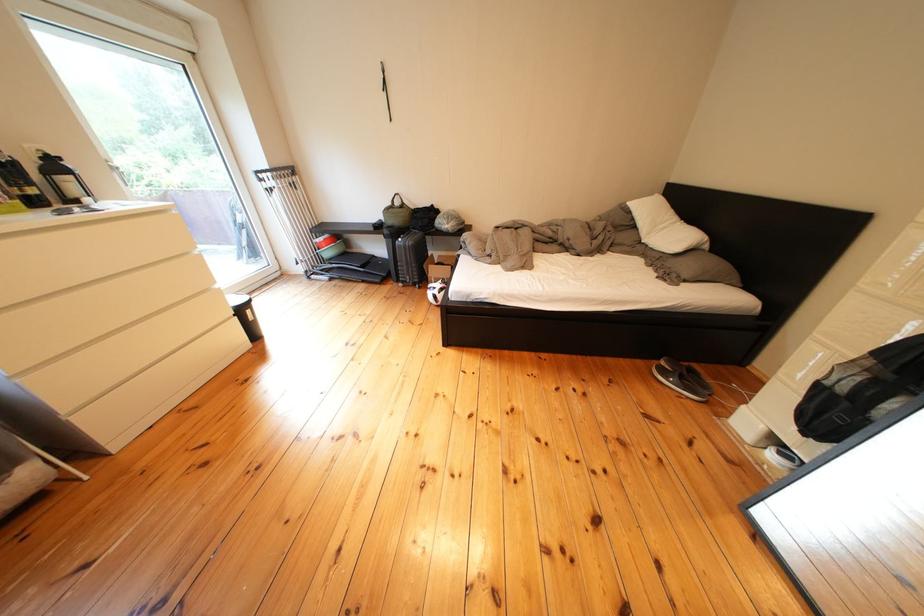
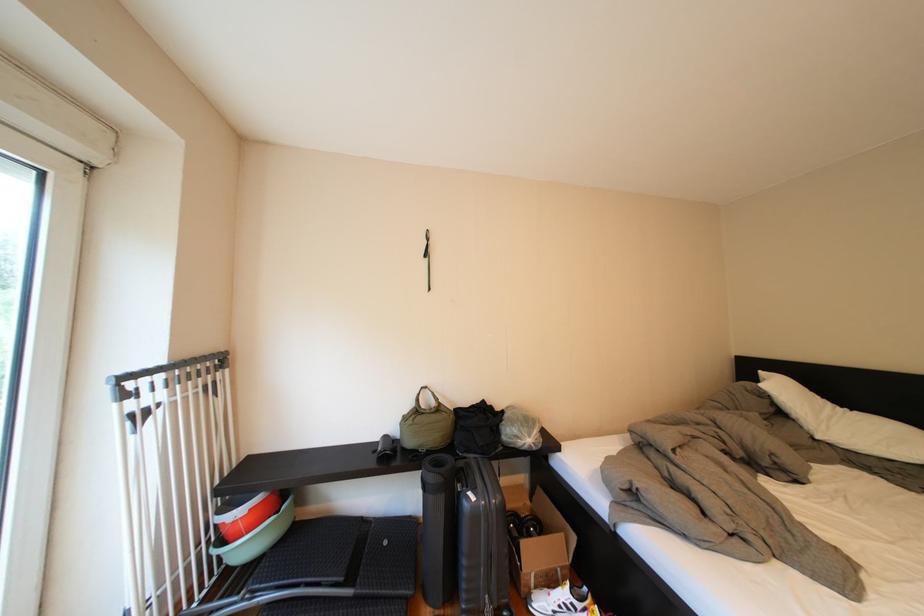
Locate, in the second image, the point that corresponds to point 379,276 in the first image.

(370, 602)